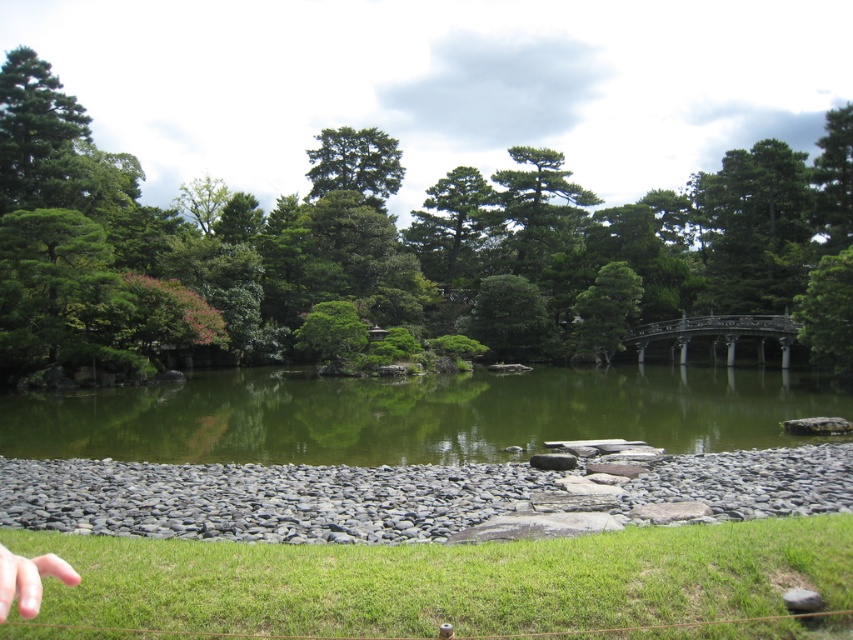
Is the position of green matte tree at upper center more distant than that of pale skin finger at lower left?

Yes, it is.

Which is more to the left, green matte tree at upper center or pale skin finger at lower left?

Positioned to the left is green matte tree at upper center.

What do you see at coordinates (355, 163) in the screenshot? The image size is (853, 640). I see `green matte tree at upper center` at bounding box center [355, 163].

This screenshot has width=853, height=640. In order to click on green matte tree at upper center in this screenshot , I will do `click(355, 163)`.

Can you confirm if green smooth water at center is wider than green matte tree at upper center?

Indeed, green smooth water at center has a greater width compared to green matte tree at upper center.

Can you confirm if green smooth water at center is shorter than green matte tree at upper center?

Indeed, green smooth water at center has a lesser height compared to green matte tree at upper center.

Which is in front, point (256, 442) or point (341, 161)?

Point (256, 442) is more forward.

I want to click on green smooth water at center, so [x=415, y=413].

Can you confirm if green leafy tree at center is smaller than green smooth water at center?

No, green leafy tree at center is not smaller than green smooth water at center.

Is point (421, 269) positioned behind point (785, 413)?

Yes.

The height and width of the screenshot is (640, 853). In order to click on green leafy tree at center in this screenshot , I will do `click(380, 241)`.